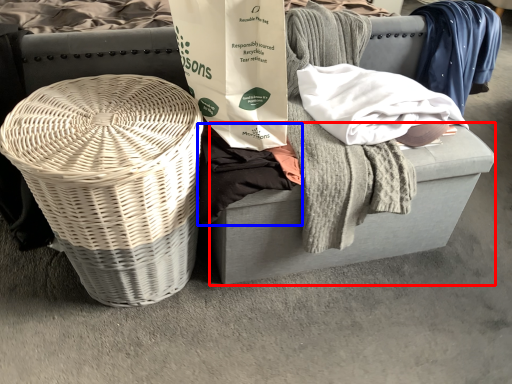
Question: Which of the following is the farthest to the observer, footrest (highlighted by a red box) or clothing (highlighted by a blue box)?

Choices:
 (A) footrest
 (B) clothing

Answer: (A)